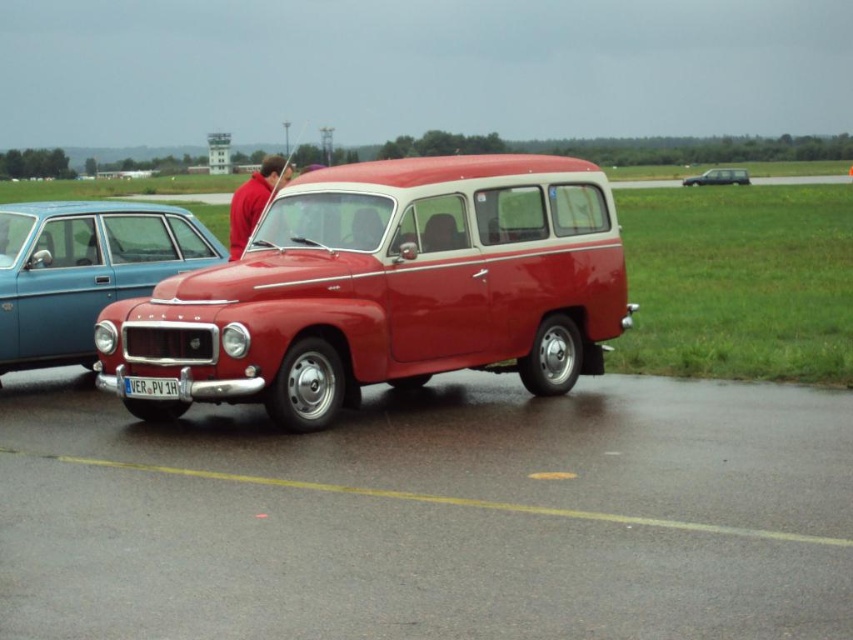
Question: Does glossy asphalt tarmac at center appear under red smooth shirt at center?

Choices:
 (A) no
 (B) yes

Answer: (B)

Question: Is shiny red station wagon at center wider than matte blue sedan at left?

Choices:
 (A) no
 (B) yes

Answer: (B)

Question: Does red smooth shirt at center have a lesser width compared to white plastic license plate at center?

Choices:
 (A) yes
 (B) no

Answer: (B)

Question: Which point is farther to the camera?

Choices:
 (A) (178, 208)
 (B) (370, 458)
 (C) (142, 385)
 (D) (553, 289)

Answer: (A)

Question: Which object is positioned closest to the red smooth shirt at center?

Choices:
 (A) matte silver van at center
 (B) shiny red station wagon at center
 (C) matte blue sedan at left

Answer: (C)

Question: Which point appears closest to the camera in this image?

Choices:
 (A) (404, 188)
 (B) (746, 182)

Answer: (A)